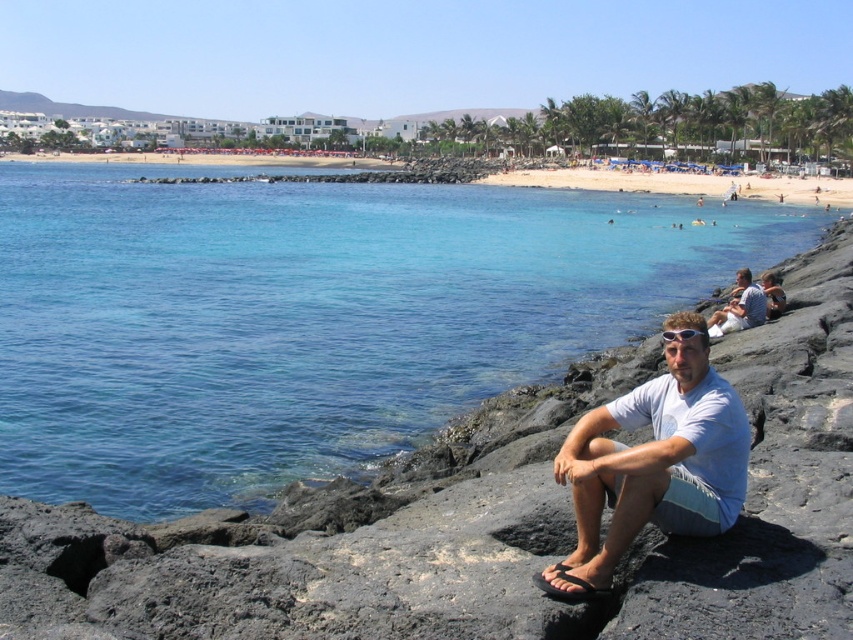
You are standing at the camera position and want to walk to the clear blue water at center. Is the distance less than 12 meters?

The distance between the clear blue water at center and the camera is 11.21 meters, which is less than 12 meters, so yes, you can walk to the clear blue water at center within that distance.

You are a photographer trying to capture a photo of the two white cotton shirts in the scene. The shirts are labeled as white cotton shirt at center and white cotton shirt at lower right. Which shirt is positioned to the left when viewed from your perspective?

The white cotton shirt at center is positioned to the left of the white cotton shirt at lower right.

You are a photographer standing on the volcanic rocks and want to capture a photo of the clear blue water at center and the white cotton shirt at center. Which object should you focus on first if you want to ensure both are in sharp focus?

The white cotton shirt at center is closer to you than the clear blue water at center, so you should focus on the white cotton shirt at center first to ensure both are in sharp focus.